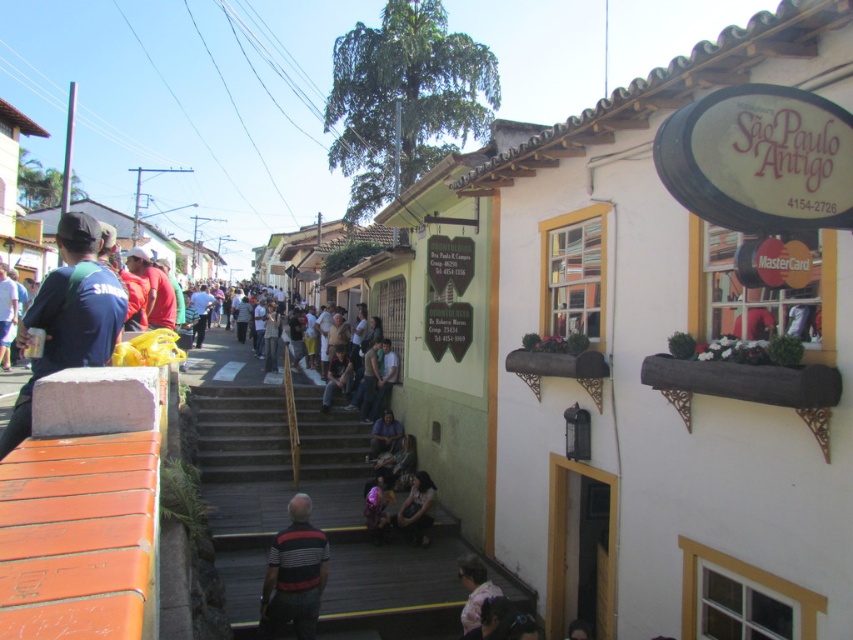
You are a photographer standing at the bottom of the wooden staircase in the historic town. You want to take a photo of both the striped cotton shirt at center and the light brown fabric shirt at lower center. Which shirt should you focus on first to ensure both are in sharp focus?

You should focus on the striped cotton shirt at center first because it is closer to the viewer than the light brown fabric shirt at lower center. By focusing on the closer object, the depth of field may allow both to be in focus if they are within the same plane or if the aperture is set appropriately. Alternatively, using a small aperture for greater depth of field would help ensure both are sharp.

You are standing on the platform bordered by the orange panels and looking down at the street. You see a striped cotton shirt at center and a pink fabric at center. Which one is closer to your left side?

The striped cotton shirt at center is to the left of pink fabric at center, so it is closer to your left side.

You are a tailor observing two shirts in the scene. The striped cotton shirt at center and the light brown fabric shirt at lower center. Which shirt has a wider width according to the description?

The striped cotton shirt at center might be wider than the light brown fabric shirt at lower center.